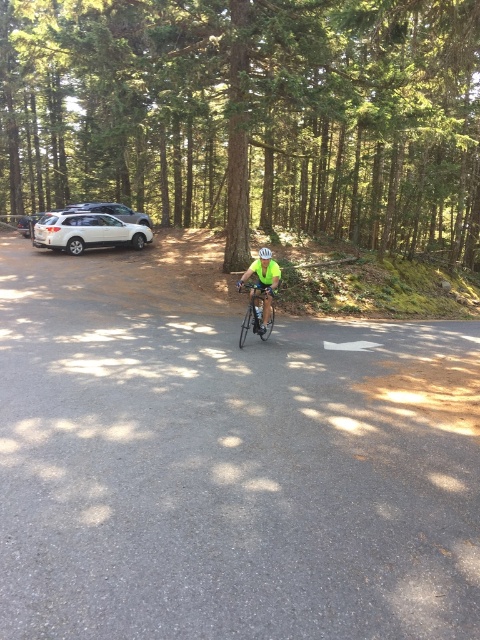
Question: Which point appears closest to the camera in this image?

Choices:
 (A) (264, 252)
 (B) (257, 291)

Answer: (B)

Question: Is green textured tree at center smaller than white matte bicycle helmet at center?

Choices:
 (A) no
 (B) yes

Answer: (A)

Question: Is green textured tree at center closer to the viewer compared to white matte suv at left?

Choices:
 (A) yes
 (B) no

Answer: (A)

Question: Which object is positioned farthest from the white matte bicycle helmet at center?

Choices:
 (A) green matte bicycle at center
 (B) green textured tree at center

Answer: (B)

Question: Which point is closer to the camera taking this photo?

Choices:
 (A) (144, 237)
 (B) (272, 326)
 (C) (375, 106)
 (D) (259, 250)

Answer: (B)

Question: Does white matte suv at left appear over white matte bicycle helmet at center?

Choices:
 (A) no
 (B) yes

Answer: (B)